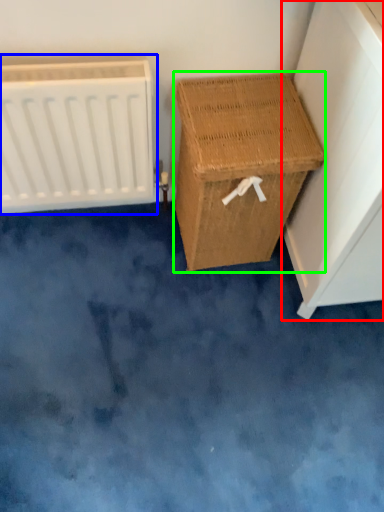
Question: Based on their relative distances, which object is farther from furniture (highlighted by a red box)? Choose from radiator (highlighted by a blue box) and furniture (highlighted by a green box).

Choices:
 (A) radiator
 (B) furniture

Answer: (A)